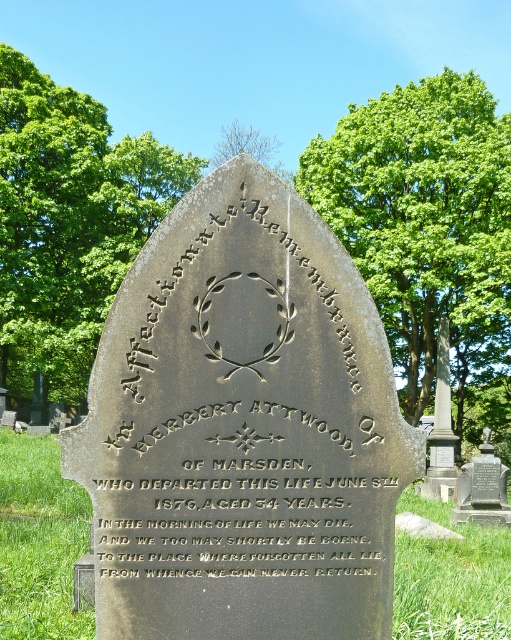
Question: Can you confirm if gold engraved text at center is smaller than green leafy tree at upper left?

Choices:
 (A) yes
 (B) no

Answer: (A)

Question: Which of the following is the closest to the observer?

Choices:
 (A) green leafy tree at top
 (B) dark gray stone tombstone at center

Answer: (B)

Question: In this image, where is gold engraved text at center located relative to green grass at lower center?

Choices:
 (A) below
 (B) above

Answer: (B)

Question: Is dark gray stone tombstone at center positioned in front of green leafy tree at upper center?

Choices:
 (A) yes
 (B) no

Answer: (A)

Question: Which object is farther from the camera taking this photo?

Choices:
 (A) green grass at lower center
 (B) green leafy tree at upper center
 (C) green leafy tree at upper left

Answer: (C)

Question: Which object is positioned farthest from the dark gray stone tombstone at center?

Choices:
 (A) gold engraved text at center
 (B) green grass at lower center
 (C) green leafy tree at upper left

Answer: (C)